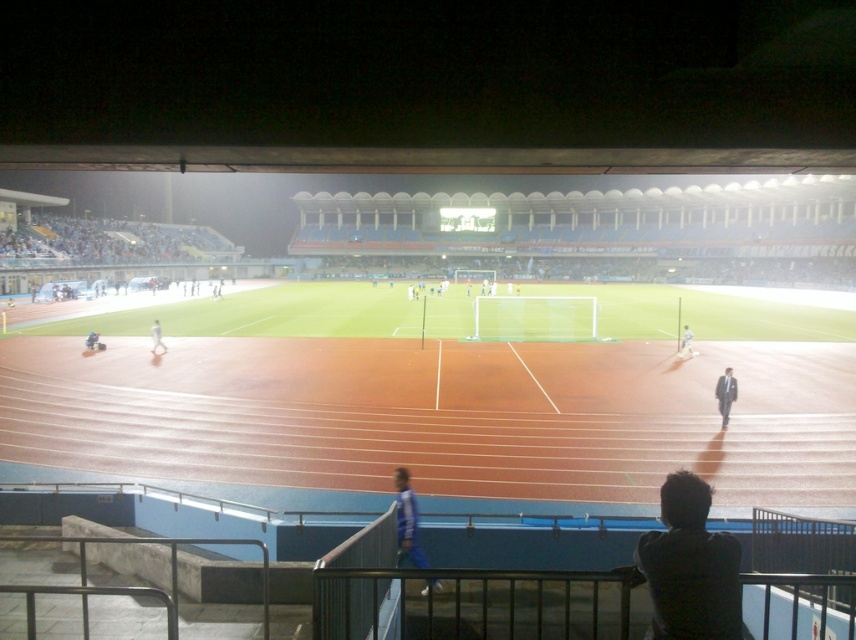
Question: Which point is closer to the camera?

Choices:
 (A) blue fabric pants at lower center
 (B) white matte person at center
 (C) dark blue shirt at lower right
 (D) light blue fabric shirt at right

Answer: (C)

Question: Among these points, which one is nearest to the camera?

Choices:
 (A) (152, 336)
 (B) (732, 628)
 (C) (728, 372)
 (D) (434, 582)

Answer: (B)

Question: Where is blue fabric pants at lower center located in relation to dark gray suit at lower right in the image?

Choices:
 (A) left
 (B) right

Answer: (A)

Question: Is dark blue shirt at lower right further to camera compared to dark gray suit at lower right?

Choices:
 (A) no
 (B) yes

Answer: (A)

Question: Considering the real-world distances, which object is farthest from the dark blue shirt at lower right?

Choices:
 (A) light blue fabric shirt at right
 (B) white matte person at center
 (C) dark gray suit at lower right

Answer: (B)

Question: Where is dark gray suit at lower right located in relation to light blue fabric shirt at right in the image?

Choices:
 (A) left
 (B) right

Answer: (A)